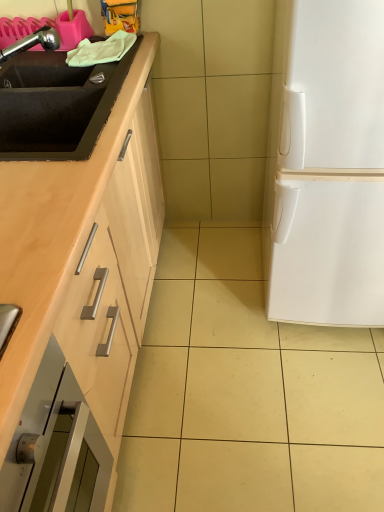
Where is `free point to the right of chrome metallic faucet at upper left, placed as the 1th sink when sorted from top to bottom`? Image resolution: width=384 pixels, height=512 pixels. free point to the right of chrome metallic faucet at upper left, placed as the 1th sink when sorted from top to bottom is located at coordinates (86, 76).